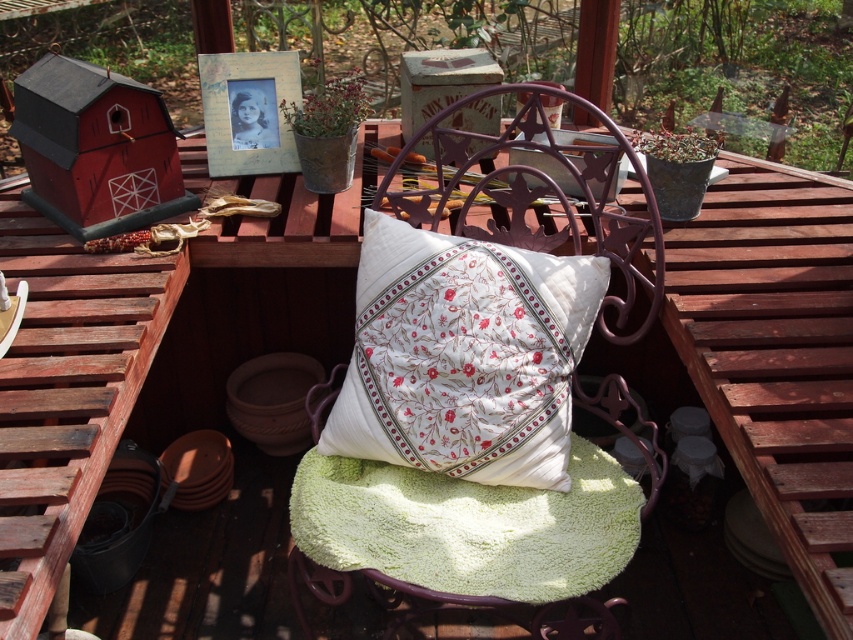
Question: Which of the following is the farthest from the observer?

Choices:
 (A) white cotton cushion at center
 (B) white floral cushion at center

Answer: (A)

Question: Can you confirm if white cotton cushion at center is wider than green fluffy blanket at center?

Choices:
 (A) yes
 (B) no

Answer: (B)

Question: Which of these objects is positioned closest to the green fluffy blanket at center?

Choices:
 (A) white floral cushion at center
 (B) white cotton cushion at center

Answer: (B)

Question: Observing the image, what is the correct spatial positioning of green fluffy blanket at center in reference to white floral cushion at center?

Choices:
 (A) below
 (B) above

Answer: (A)

Question: Can you confirm if green fluffy blanket at center is positioned to the right of white floral cushion at center?

Choices:
 (A) yes
 (B) no

Answer: (B)

Question: Which object is positioned farthest from the white cotton cushion at center?

Choices:
 (A) green fluffy blanket at center
 (B) white floral cushion at center

Answer: (B)